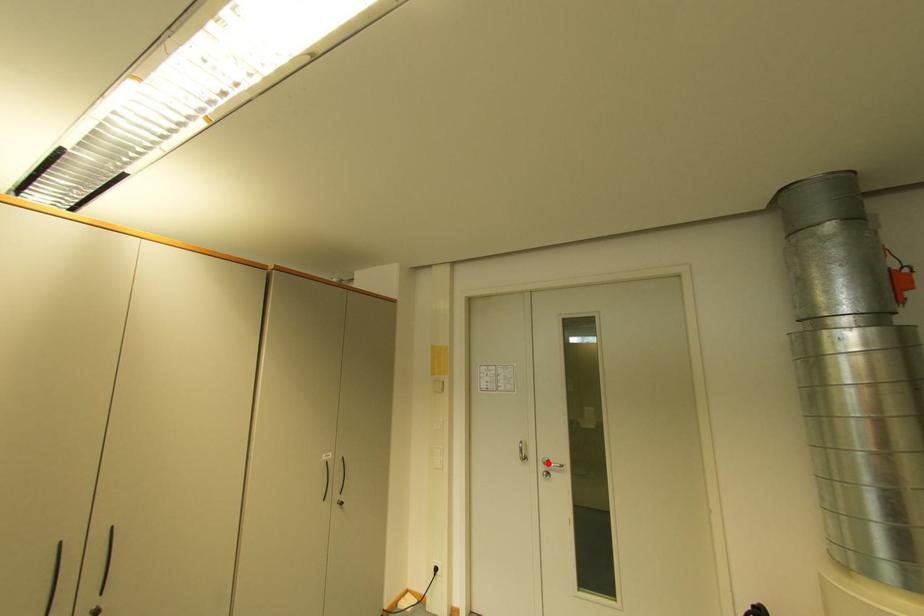
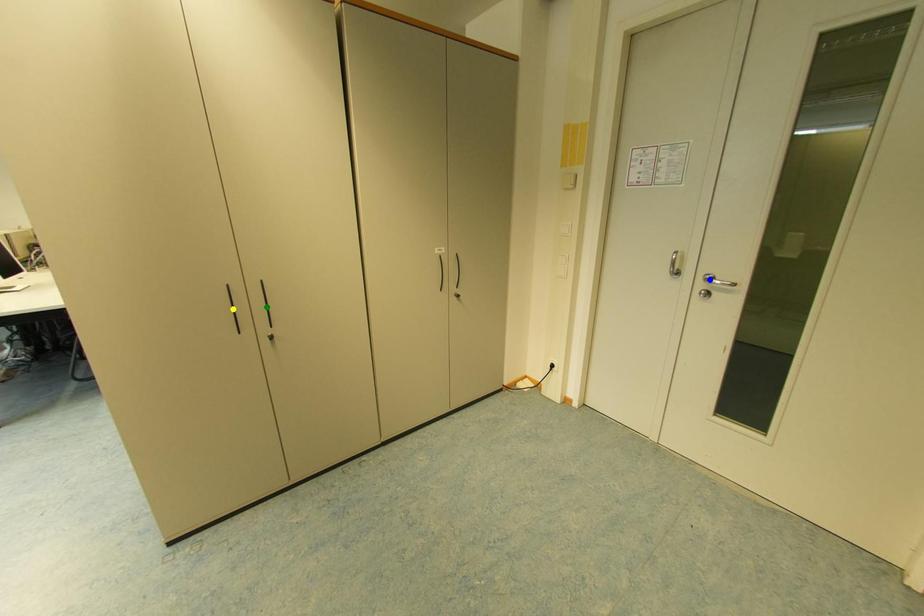
Question: I am providing you with two images of the same scene from different viewpoints. A red point is marked on the first image. You are given multiple points on the second image. Which point in image 2 is actually the same real-world point as the red point in image 1?

Choices:
 (A) blue point
 (B) yellow point
 (C) green point

Answer: (A)